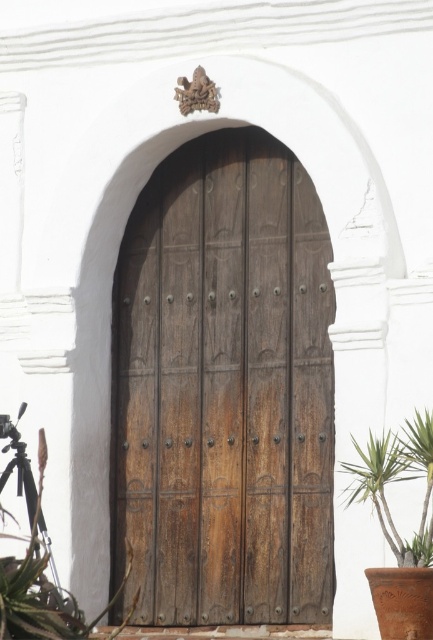
Who is taller, brown wooden door at center or green leafy plant at lower left?

Standing taller between the two is brown wooden door at center.

This screenshot has height=640, width=433. Find the location of `brown wooden door at center`. brown wooden door at center is located at coordinates (225, 388).

Between point (35, 593) and point (352, 438), which one is positioned in front?

Point (35, 593) is more forward.

Who is shorter, green leafy plant at lower left or green leafy plant at lower right?

green leafy plant at lower right

What do you see at coordinates (42, 588) in the screenshot? I see `green leafy plant at lower left` at bounding box center [42, 588].

Locate an element on the screen. green leafy plant at lower left is located at coordinates (42, 588).

The image size is (433, 640). I want to click on brown wooden door at center, so click(225, 388).

Is point (149, 394) closer to viewer compared to point (352, 497)?

No.

Which is behind, point (265, 346) or point (342, 465)?

The point (265, 346) is behind.

This screenshot has width=433, height=640. Identify the location of brown wooden door at center. (x=225, y=388).